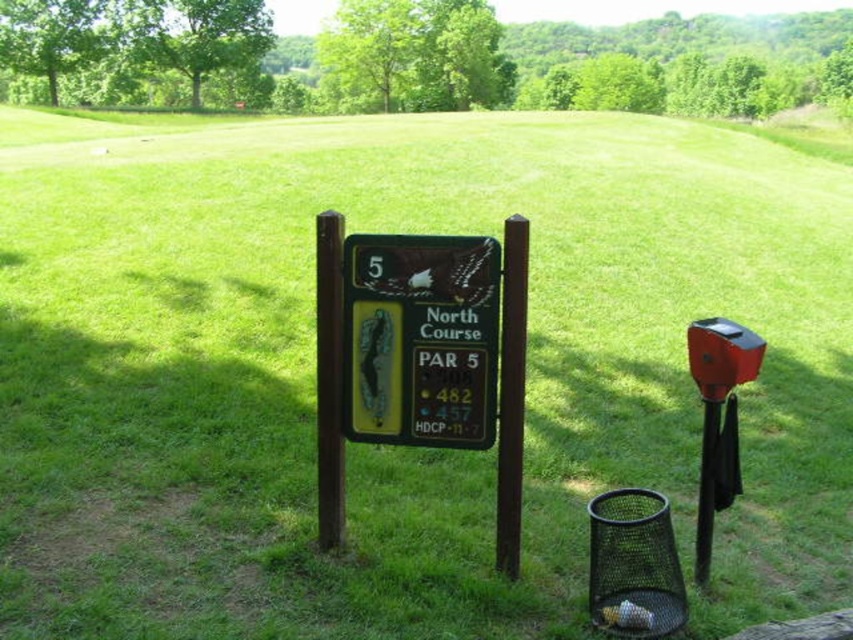
Question: From the image, what is the correct spatial relationship of wooden sign at center in relation to brown wood pole at center?

Choices:
 (A) below
 (B) above

Answer: (B)

Question: Which point is farther to the camera?

Choices:
 (A) (393, 388)
 (B) (508, 552)

Answer: (A)

Question: Which object appears farthest from the camera in this image?

Choices:
 (A) wooden sign at center
 (B) brown wood pole at center

Answer: (A)

Question: Which of the following is the farthest from the observer?

Choices:
 (A) (341, 422)
 (B) (405, 394)
 (C) (505, 248)

Answer: (A)

Question: Is wooden sign at center thinner than brown polished wood post at center?

Choices:
 (A) yes
 (B) no

Answer: (B)

Question: Is wooden sign at center above brown polished wood post at center?

Choices:
 (A) no
 (B) yes

Answer: (B)